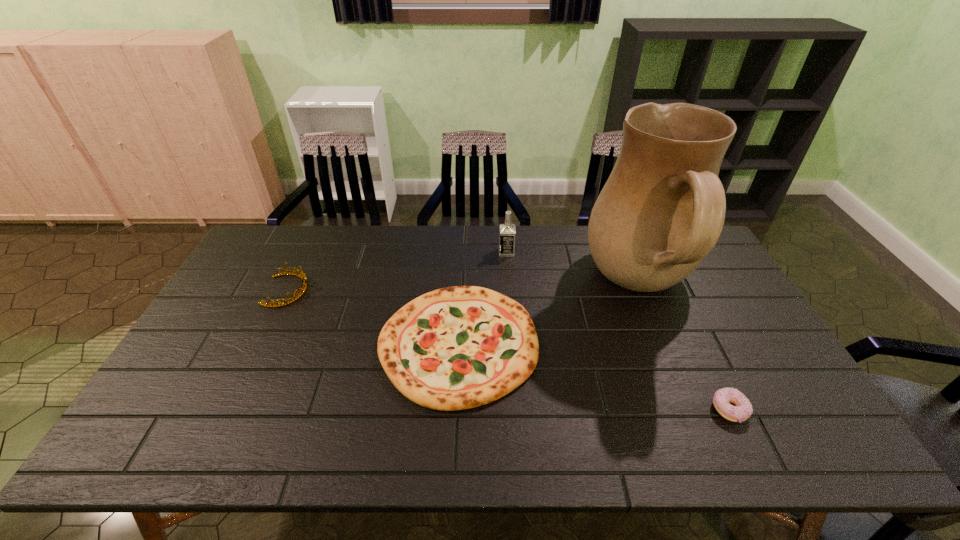
Image resolution: width=960 pixels, height=540 pixels. I want to click on blank area located 0.180m on the front label of the fourth shortest object, so click(447, 252).

This screenshot has height=540, width=960. Identify the location of free location located 0.390m on the front label of the fourth shortest object. (387, 252).

Locate an element on the screen. The image size is (960, 540). vacant space situated 0.310m on the front-facing side of the leftmost object is located at coordinates (407, 291).

Find the location of a particular element. The image size is (960, 540). blank space located on the back of the pizza is located at coordinates (463, 244).

In order to click on free spot located 0.250m on the left of the doughnut in this screenshot , I will do `click(609, 410)`.

Find the location of `cream pitcher at the far edge`. cream pitcher at the far edge is located at coordinates (662, 210).

The image size is (960, 540). What are the coordinates of `vodka that is at the far edge` in the screenshot? It's located at (507, 231).

You are a GUI agent. You are given a task and a screenshot of the screen. Output one action in this format:
    pyautogui.click(x=<x>, y=<y>)
    Task: Click on the object that is at the near edge
    The image size is (960, 540).
    Given the screenshot: What is the action you would take?
    pyautogui.click(x=742, y=409)

At what (x,y) coordinates should I click in order to perform the action: click on object present at the left edge. Please return your answer as a coordinate pair (x, y). Image resolution: width=960 pixels, height=540 pixels. Looking at the image, I should click on (303, 288).

You are a GUI agent. You are given a task and a screenshot of the screen. Output one action in this format:
    pyautogui.click(x=<x>, y=<y>)
    Task: Click on the cream pitcher positioned at the right edge
    
    Given the screenshot: What is the action you would take?
    pyautogui.click(x=662, y=210)